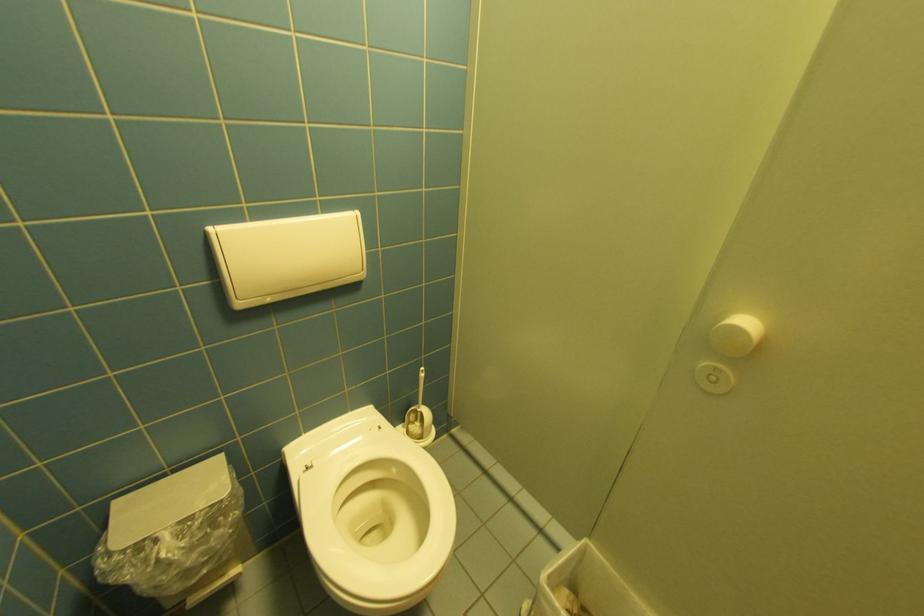
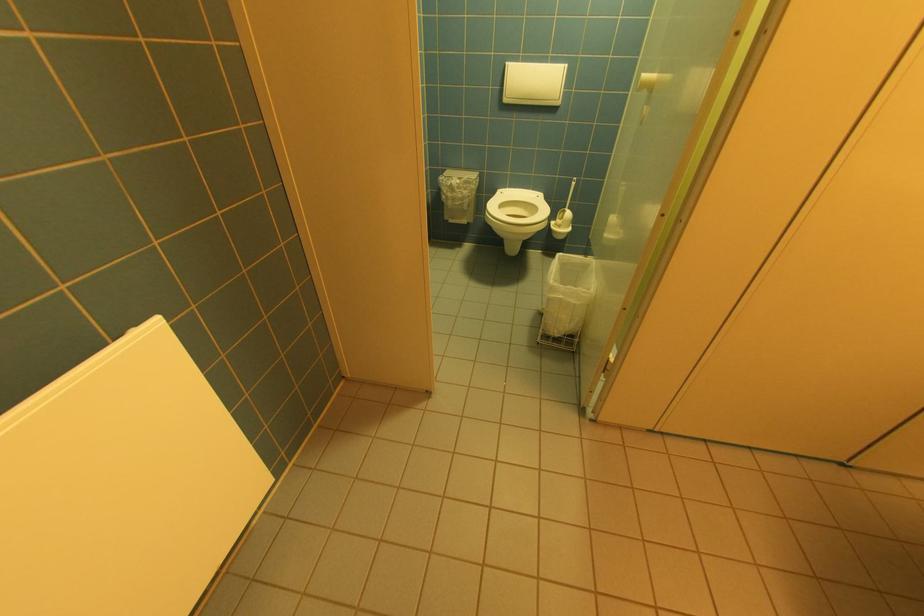
Where in the second image is the point corresponding to (x=245, y=305) from the first image?

(512, 100)